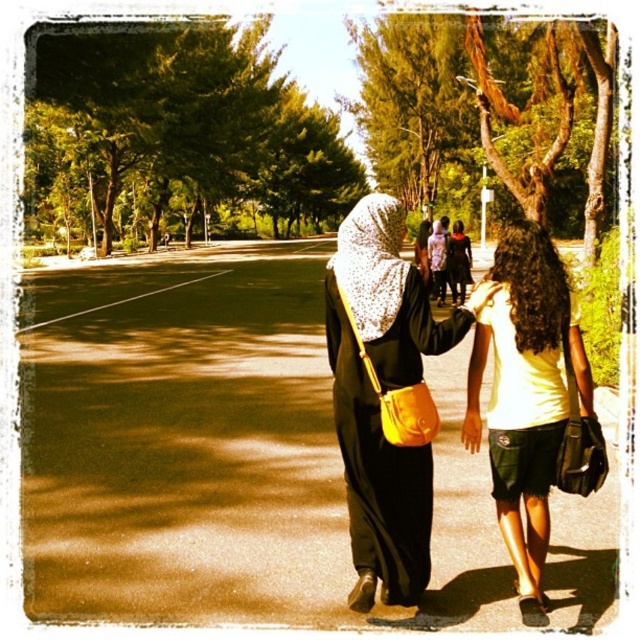
You are a photographer trying to capture a closeup shot of the matte yellow bag at center and the white matte dress at center. Since your camera can only focus on one object at a time, which object should you choose to ensure it fills the frame more effectively?

The matte yellow bag at center has a larger width than the white matte dress at center, so choosing the matte yellow bag at center will fill the frame more effectively.

You are a photographer standing in the park and see the matte yellow shirt at center and the white matte dress at center. Which clothing item is positioned lower in the image?

The matte yellow shirt at center is located below the white matte dress at center, so it is positioned lower in the image.